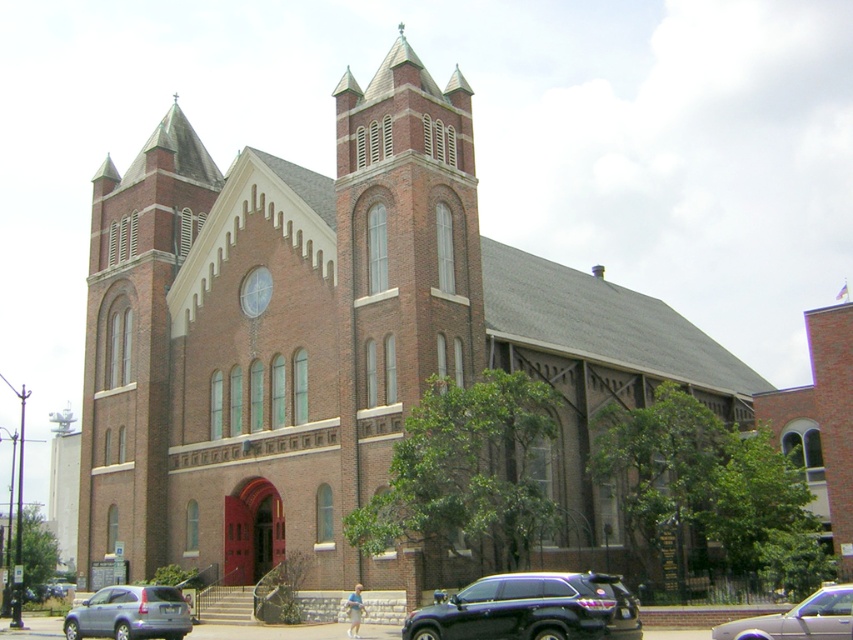
You are standing in front of the church and want to take a photo. You notice two points marked on the church facade. The first point is at coordinates point (498, 634) and the second is at point (827, 604). Which point will appear closer to the bottom edge of your camera viewfinder?

Point (498, 634) is further to the camera than point (827, 604). Since it is closer to the camera, it will appear closer to the bottom edge of the camera viewfinder.

You are a pedestrian standing in front of the historic brick church. You see a metallic gray suv at lower left and a metallic silver sedan at lower right. Which vehicle is closer to the shorter tower?

The metallic gray suv at lower left is positioned under the metallic silver sedan at lower right, so the metallic gray suv at lower left is closer to the shorter tower.

You are a delivery driver with a truck that is 6 meters long. You need to park your truck between the black matte suv at lower center and the metallic gray suv at lower left. Is there enough space between them to park your truck?

The black matte suv at lower center and metallic gray suv at lower left are 15.99 meters apart from each other. Since the truck is 6 meters long, there is sufficient space between them to park the truck.